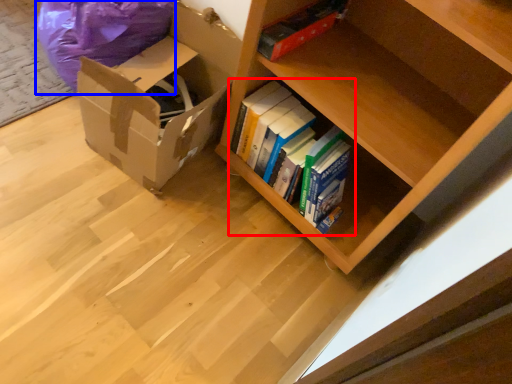
Question: Which object is closer to the camera taking this photo, book (highlighted by a red box) or bean bag chair (highlighted by a blue box)?

Choices:
 (A) book
 (B) bean bag chair

Answer: (B)